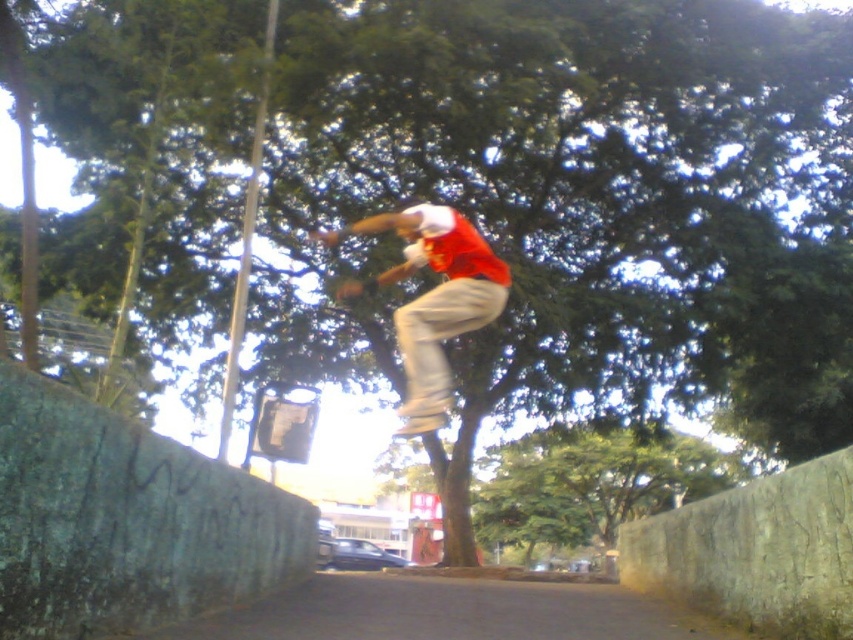
You are a photographer trying to capture the exact point where the person lands after their jump. The scene has a paved pathway bordered by two walls. The left wall has graffiti. You need to ensure your camera is focused on the exact landing spot, which is marked by the point at coordinates [434,300]. Can you confirm the location of this point in the scene?

The point at coordinates [434,300] corresponds to the matte red shirt at center, so the landing spot is where the matte red shirt at center is located.

You are a photographer trying to capture the perfect shot of the person jumping on the skateboard. You need to ensure the matte red shirt at center and the wooden skateboard at center are in focus. Given that your camera can only focus on objects within a 4.5 meter distance range, will both objects be in focus?

The matte red shirt at center is 4.85 meters away from the wooden skateboard at center. Since the distance between them exceeds the camera focus range of 4.5 meters, they cannot both be in focus simultaneously.

You are a photographer trying to capture the perfect shot of the person jumping. You want to ensure the wooden skateboard at center is visible in the frame. Given that the matte red shirt at center is in front of it, where should you position the camera relative to the person?

To ensure the wooden skateboard at center is visible behind the matte red shirt at center, position the camera so it is looking through the space between the person and the shirt, or slightly behind the person where the skateboard is positioned. Since the wooden skateboard at center is behind the matte red shirt at center, angling the camera from behind the person or slightly to the side might allow the skateboard to be seen through gaps in the shirt or around the body.